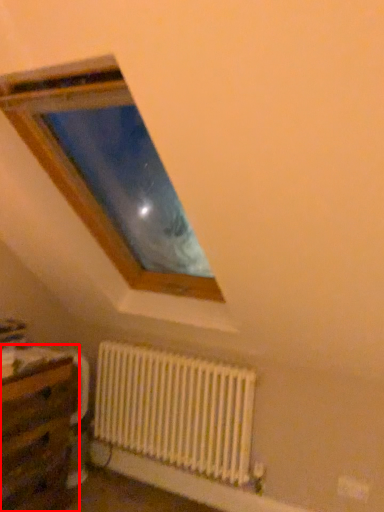
Question: Where is table (annotated by the red box) located in relation to radiator in the image?

Choices:
 (A) right
 (B) left

Answer: (B)